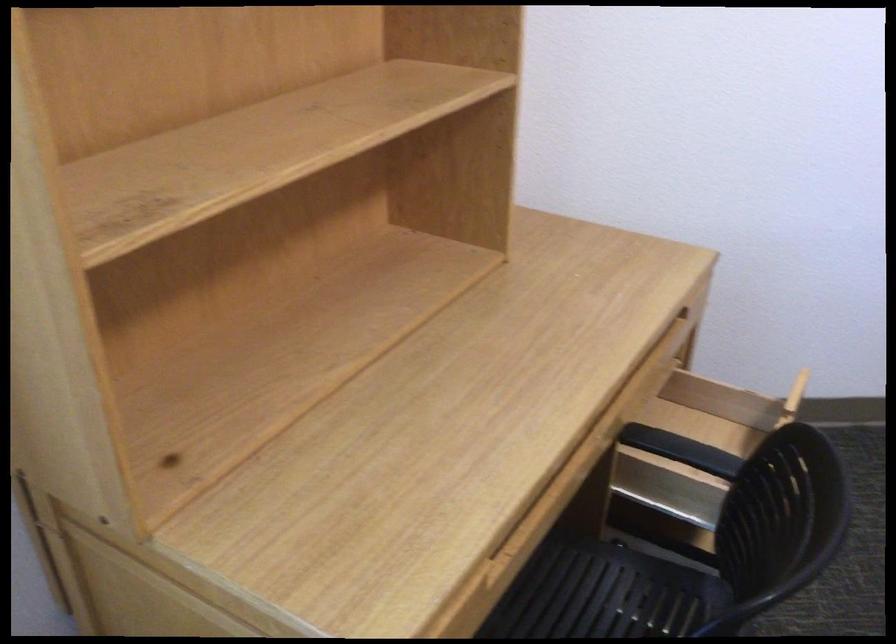
Image resolution: width=896 pixels, height=644 pixels. I want to click on black chair armrest, so click(x=679, y=450).